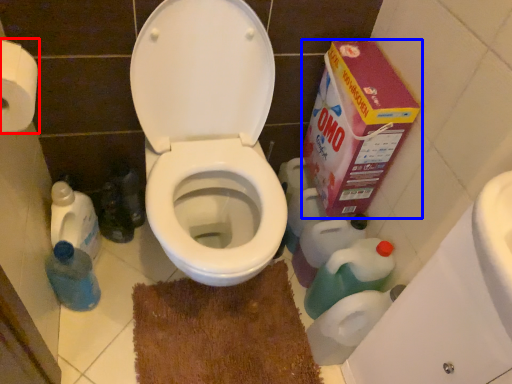
Question: Among these objects, which one is farthest to the camera, toilet paper (highlighted by a red box) or cardboard box (highlighted by a blue box)?

Choices:
 (A) toilet paper
 (B) cardboard box

Answer: (B)